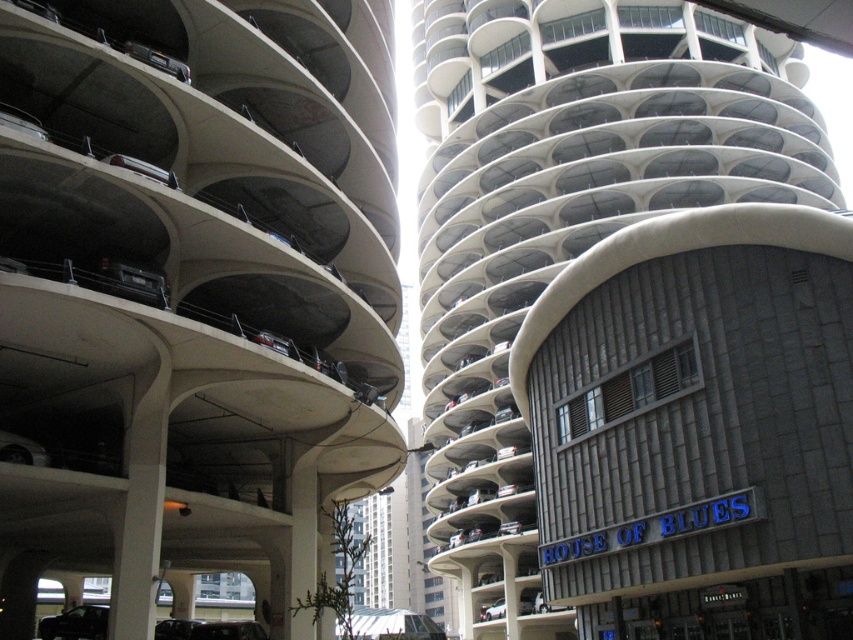
Who is lower down, shiny black suv at lower left or matte black car at lower left?

Positioned lower is shiny black suv at lower left.

Who is more forward, (61,618) or (167,621)?

Point (61,618) is more forward.

At what (x,y) coordinates should I click in order to perform the action: click on shiny black suv at lower left. Please return your answer as a coordinate pair (x, y). Looking at the image, I should click on (74, 624).

Is point (241, 630) more distant than point (193, 624)?

No, (241, 630) is in front of (193, 624).

Does black glossy car at lower center have a greater height compared to matte black car at lower left?

Indeed, black glossy car at lower center has a greater height compared to matte black car at lower left.

Which is behind, point (248, 628) or point (172, 621)?

The point (172, 621) is behind.

Image resolution: width=853 pixels, height=640 pixels. I want to click on black glossy car at lower center, so click(228, 630).

Is shiny black suv at lower left shorter than black glossy car at lower center?

Correct, shiny black suv at lower left is not as tall as black glossy car at lower center.

Which is in front, point (45, 632) or point (221, 625)?

Point (221, 625)

Where is `shiny black suv at lower left`? shiny black suv at lower left is located at coordinates (74, 624).